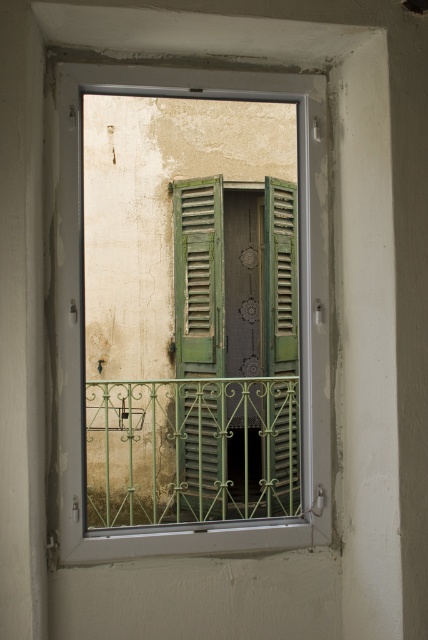
Does green matte shutters at center come behind green wooden shutters at center?

That is True.

Can you confirm if green matte shutters at center is taller than green wooden shutters at center?

Correct, green matte shutters at center is much taller as green wooden shutters at center.

At what (x,y) coordinates should I click in order to perform the action: click on green matte shutters at center. Please return your answer as a coordinate pair (x, y). Looking at the image, I should click on pyautogui.click(x=190, y=310).

Identify the location of green matte shutters at center. Image resolution: width=428 pixels, height=640 pixels. (190, 310).

Who is taller, green matte shutters at center or green wrought iron balcony at center?

green matte shutters at center

Can you confirm if green matte shutters at center is positioned to the right of green wrought iron balcony at center?

Incorrect, green matte shutters at center is not on the right side of green wrought iron balcony at center.

Is point (134, 550) farther from viewer compared to point (94, 461)?

That is False.

This screenshot has height=640, width=428. I want to click on green matte shutters at center, so click(x=190, y=310).

Does green wooden shutters at center have a smaller size compared to green wrought iron balcony at center?

Incorrect, green wooden shutters at center is not smaller in size than green wrought iron balcony at center.

Where is `green wooden shutters at center`? green wooden shutters at center is located at coordinates (235, 348).